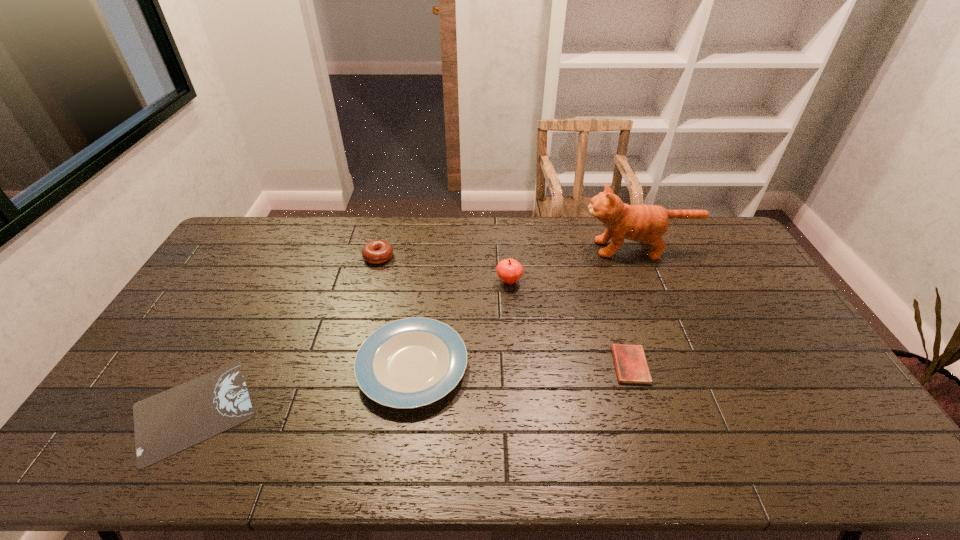
Find the location of a particular element. The image size is (960, 540). cat is located at coordinates (647, 223).

Identify the location of apple. (509, 271).

I want to click on the fifth shortest object, so click(x=509, y=271).

This screenshot has height=540, width=960. What are the coordinates of `the fourth shortest object` in the screenshot? It's located at (377, 251).

Locate an element on the screen. the third shortest object is located at coordinates (412, 362).

Locate an element on the screen. This screenshot has height=540, width=960. diary is located at coordinates (630, 361).

At what (x,y) coordinates should I click in order to perform the action: click on the leftmost object. Please return your answer as a coordinate pair (x, y). This screenshot has width=960, height=540. Looking at the image, I should click on (169, 422).

Identify the location of mousepad. This screenshot has width=960, height=540. (169, 422).

The height and width of the screenshot is (540, 960). In order to click on vacant space located on the face of the cat in this screenshot , I will do `click(543, 249)`.

You are a GUI agent. You are given a task and a screenshot of the screen. Output one action in this format:
    pyautogui.click(x=<x>, y=<y>)
    Task: Click on the free spot located on the face of the cat
    The width and height of the screenshot is (960, 540).
    Given the screenshot: What is the action you would take?
    pyautogui.click(x=533, y=249)